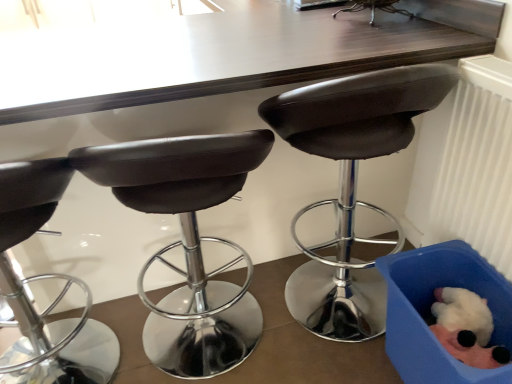
Describe the element at coordinates (351, 183) in the screenshot. I see `matte black stool at center, the third chair in the left-to-right sequence` at that location.

Locate an element on the screen. This screenshot has width=512, height=384. matte black stool at left, which is the 4th chair in right-to-left order is located at coordinates (45, 278).

Describe the element at coordinates (188, 242) in the screenshot. This screenshot has width=512, height=384. I see `matte black stool at center, placed as the 3th chair when sorted from right to left` at that location.

What do you see at coordinates (432, 315) in the screenshot? Image resolution: width=512 pixels, height=384 pixels. I see `blue fabric box at lower right` at bounding box center [432, 315].

Image resolution: width=512 pixels, height=384 pixels. What do you see at coordinates (374, 8) in the screenshot?
I see `metallic silver stool at center, which is the fourth chair from left to right` at bounding box center [374, 8].

Identify the location of matte black stool at center, the third chair in the left-to-right sequence. The image size is (512, 384). (351, 183).

Does matte black stool at center, the second chair from the left, turn towards metallic silver stool at center, which is the fourth chair from left to right?

No, matte black stool at center, the second chair from the left, is not aimed at metallic silver stool at center, which is the fourth chair from left to right.

From the image's perspective, is matte black stool at center, placed as the 3th chair when sorted from right to left, located above or below metallic silver stool at center, positioned as the 1th chair in right-to-left order?

matte black stool at center, placed as the 3th chair when sorted from right to left, is situated lower than metallic silver stool at center, positioned as the 1th chair in right-to-left order, in the image.

How many degrees apart are the facing directions of matte black stool at center, the second chair from the left, and metallic silver stool at center, which is the fourth chair from left to right?

matte black stool at center, the second chair from the left, and metallic silver stool at center, which is the fourth chair from left to right, are facing 90.7 degrees away from each other.

Considering the points (184, 160) and (359, 10), which point is behind, point (184, 160) or point (359, 10)?

Positioned behind is point (359, 10).

Is blue fabric box at lower right next to metallic silver stool at center, which is the fourth chair from left to right, and touching it?

blue fabric box at lower right is not next to metallic silver stool at center, which is the fourth chair from left to right, and they're not touching.

In the scene shown: Is blue fabric box at lower right positioned before metallic silver stool at center, which is the fourth chair from left to right?

Yes.

Who is taller, blue fabric box at lower right or metallic silver stool at center, positioned as the 1th chair in right-to-left order?

Standing taller between the two is blue fabric box at lower right.

Between metallic silver stool at center, which is the fourth chair from left to right, and matte black stool at center, the second chair from the left, which one appears on the right side from the viewer's perspective?

Positioned to the right is metallic silver stool at center, which is the fourth chair from left to right.

From the image's perspective, which one is positioned lower, metallic silver stool at center, which is the fourth chair from left to right, or matte black stool at center, placed as the 3th chair when sorted from right to left?

matte black stool at center, placed as the 3th chair when sorted from right to left, is shown below in the image.

Would you say metallic silver stool at center, positioned as the 1th chair in right-to-left order, contains matte black stool at center, placed as the 3th chair when sorted from right to left?

No, metallic silver stool at center, positioned as the 1th chair in right-to-left order, does not contain matte black stool at center, placed as the 3th chair when sorted from right to left.

Which is further, (368, 1) or (222, 351)?

The point (368, 1) is more distant.

Between point (17, 353) and point (498, 337), which one is positioned behind?

Positioned behind is point (17, 353).

From the image's perspective, between matte black stool at left, acting as the 1th chair starting from the left, and blue fabric box at lower right, who is located below?

blue fabric box at lower right.

Which of these two, matte black stool at left, which is the 4th chair in right-to-left order, or blue fabric box at lower right, is wider?

matte black stool at left, which is the 4th chair in right-to-left order.

From a real-world perspective, is matte black stool at left, acting as the 1th chair starting from the left, below blue fabric box at lower right?

No.

Between blue fabric box at lower right and white plastic radiator at right, which one has larger width?

blue fabric box at lower right is wider.

Would you say white plastic radiator at right is part of blue fabric box at lower right's contents?

Definitely not — white plastic radiator at right is not inside blue fabric box at lower right.

Considering the positions of objects blue fabric box at lower right and white plastic radiator at right in the image provided, who is behind, blue fabric box at lower right or white plastic radiator at right?

blue fabric box at lower right is further from the camera.

Consider the image. Considering the sizes of blue fabric box at lower right and matte black stool at center, placed as the 3th chair when sorted from right to left, in the image, is blue fabric box at lower right wider or thinner than matte black stool at center, placed as the 3th chair when sorted from right to left,?

Clearly, blue fabric box at lower right has less width compared to matte black stool at center, placed as the 3th chair when sorted from right to left.

From a real-world perspective, is blue fabric box at lower right physically below matte black stool at center, the second chair from the left?

Yes, from a real-world perspective, blue fabric box at lower right is beneath matte black stool at center, the second chair from the left.

Which is more to the left, blue fabric box at lower right or matte black stool at center, placed as the 3th chair when sorted from right to left?

matte black stool at center, placed as the 3th chair when sorted from right to left.

Is blue fabric box at lower right oriented away from matte black stool at left, acting as the 1th chair starting from the left?

No, blue fabric box at lower right is not facing away from matte black stool at left, acting as the 1th chair starting from the left.

Is blue fabric box at lower right to the right of matte black stool at left, acting as the 1th chair starting from the left, from the viewer's perspective?

Yes, blue fabric box at lower right is to the right of matte black stool at left, acting as the 1th chair starting from the left.

Is blue fabric box at lower right positioned beyond the bounds of matte black stool at left, acting as the 1th chair starting from the left?

Yes.

From a real-world perspective, which chair is the 3rd one underneath the metallic silver stool at center, positioned as the 1th chair in right-to-left order? Please provide its 2D coordinates.

[(188, 242)]

Find the location of `box that is below the metallic silver stool at center, which is the fourth chair from left to right (from the image's perspective)`. box that is below the metallic silver stool at center, which is the fourth chair from left to right (from the image's perspective) is located at coordinates (432, 315).

When comparing their distances from matte black stool at center, the second chair from the right, does matte black stool at center, the second chair from the left, or blue fabric box at lower right seem further?

The object further to matte black stool at center, the second chair from the right, is matte black stool at center, the second chair from the left.

Considering their positions, is metallic silver stool at center, which is the fourth chair from left to right, positioned closer to matte black stool at center, the third chair in the left-to-right sequence, than matte black stool at center, the second chair from the left?

The object closer to matte black stool at center, the third chair in the left-to-right sequence, is matte black stool at center, the second chair from the left.

Considering their positions, is matte black stool at left, acting as the 1th chair starting from the left, positioned further to metallic silver stool at center, which is the fourth chair from left to right, than blue fabric box at lower right?

matte black stool at left, acting as the 1th chair starting from the left.

Considering their positions, is fluffy white plush toy at lower right positioned closer to white plastic radiator at right than metallic silver stool at center, positioned as the 1th chair in right-to-left order?

fluffy white plush toy at lower right.

Looking at the image, which one is located closer to white plastic radiator at right, blue fabric box at lower right or metallic silver stool at center, positioned as the 1th chair in right-to-left order?

blue fabric box at lower right lies closer to white plastic radiator at right than the other object.

Consider the image. When comparing their distances from matte black stool at center, the third chair in the left-to-right sequence, does blue fabric box at lower right or metallic silver stool at center, positioned as the 1th chair in right-to-left order, seem closer?

The object closer to matte black stool at center, the third chair in the left-to-right sequence, is blue fabric box at lower right.

When comparing their distances from blue fabric box at lower right, does matte black stool at center, placed as the 3th chair when sorted from right to left, or metallic silver stool at center, which is the fourth chair from left to right, seem further?

Among the two, metallic silver stool at center, which is the fourth chair from left to right, is located further to blue fabric box at lower right.

Estimate the real-world distances between objects in this image. Which object is further from white plastic radiator at right, matte black stool at center, the second chair from the right, or fluffy white plush toy at lower right?

matte black stool at center, the second chair from the right, lies further to white plastic radiator at right than the other object.

Find the location of a particular element. This screenshot has width=512, height=384. animal situated between matte black stool at center, the second chair from the right, and white plastic radiator at right from left to right is located at coordinates (466, 328).

You are a GUI agent. You are given a task and a screenshot of the screen. Output one action in this format:
    pyautogui.click(x=<x>, y=<y>)
    Task: Click on the box between matte black stool at left, acting as the 1th chair starting from the left, and white plastic radiator at right, in the horizontal direction
    
    Given the screenshot: What is the action you would take?
    pyautogui.click(x=432, y=315)

You are a GUI agent. You are given a task and a screenshot of the screen. Output one action in this format:
    pyautogui.click(x=<x>, y=<y>)
    Task: Click on the animal between matte black stool at center, the second chair from the left, and white plastic radiator at right, in the horizontal direction
    
    Given the screenshot: What is the action you would take?
    pyautogui.click(x=466, y=328)

The image size is (512, 384). I want to click on animal between metallic silver stool at center, positioned as the 1th chair in right-to-left order, and blue fabric box at lower right vertically, so click(x=466, y=328).